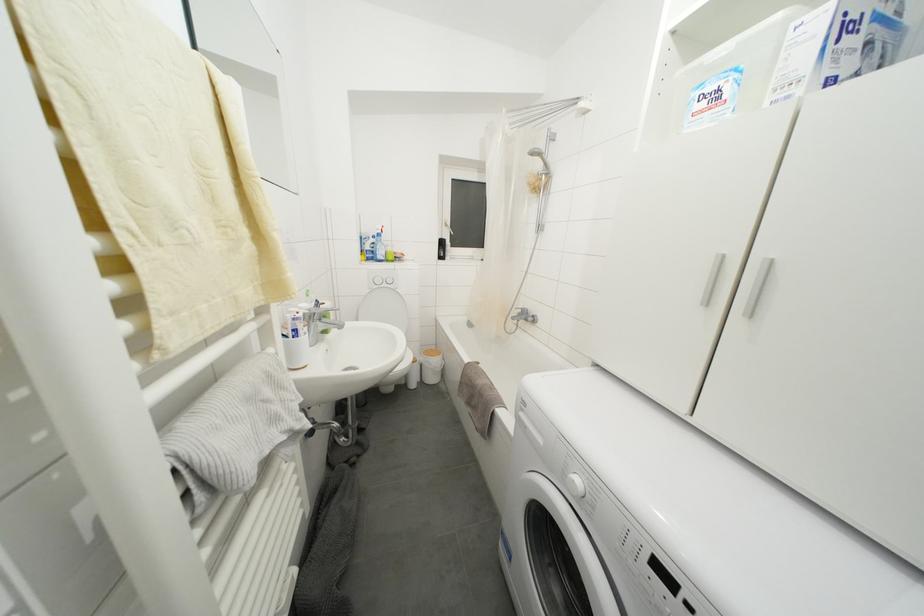
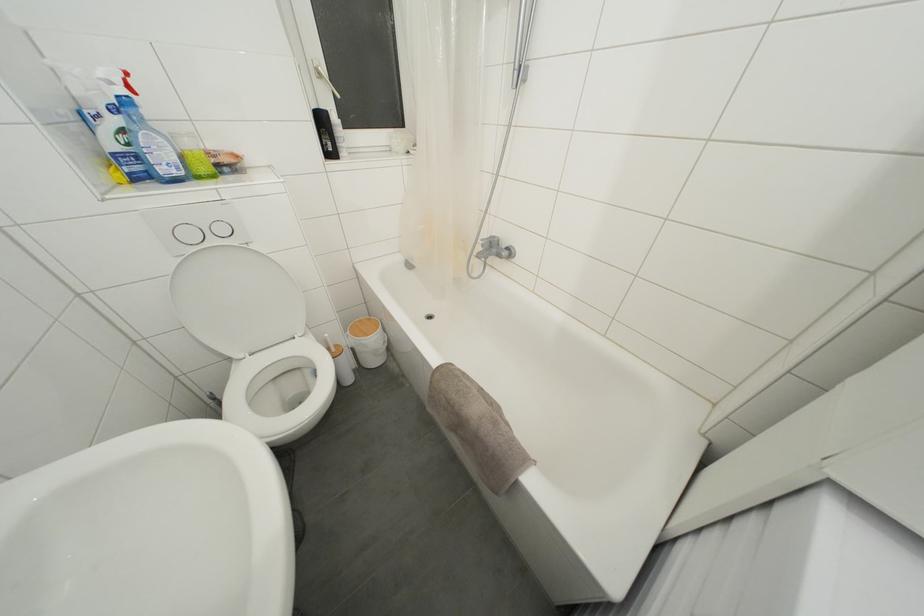
Where in the second image is the point corresponding to point (393, 254) from the first image?

(193, 148)